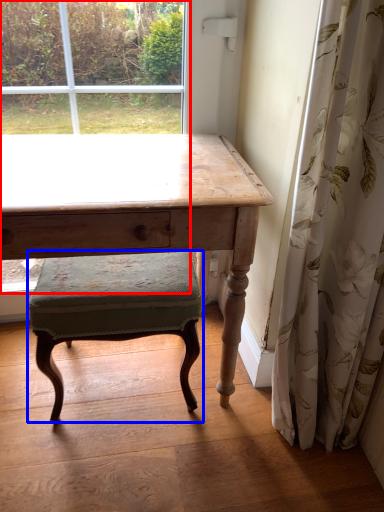
Question: Among these objects, which one is nearest to the camera, bay window (highlighted by a red box) or stool (highlighted by a blue box)?

Choices:
 (A) bay window
 (B) stool

Answer: (A)